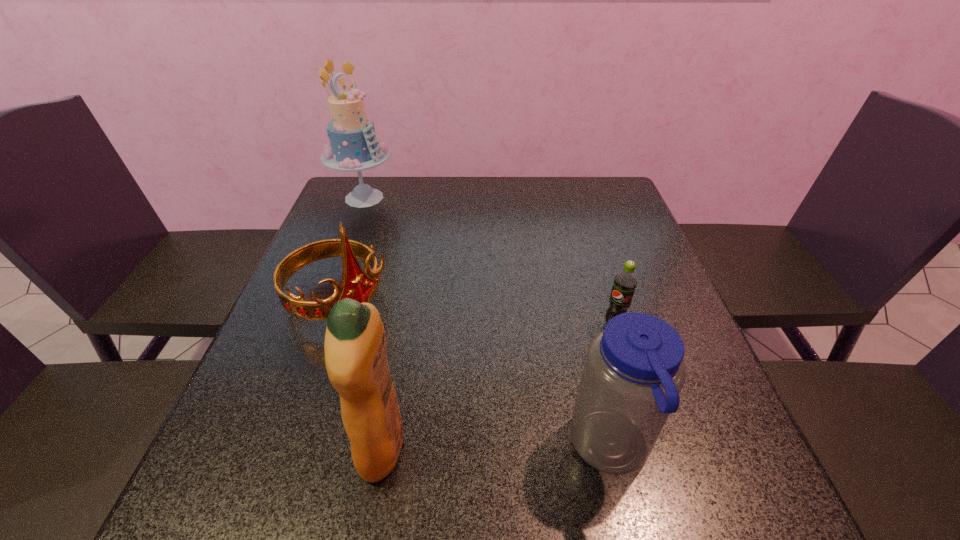
Locate an element on the screen. detergent is located at coordinates (355, 348).

The height and width of the screenshot is (540, 960). Identify the location of the third object from right to left. (355, 348).

I want to click on water bottle, so click(x=634, y=370).

Image resolution: width=960 pixels, height=540 pixels. I want to click on cake, so click(x=353, y=147).

I want to click on the tallest object, so click(353, 147).

Image resolution: width=960 pixels, height=540 pixels. I want to click on the shortest object, so click(625, 282).

Where is `tiara`? tiara is located at coordinates (356, 284).

Image resolution: width=960 pixels, height=540 pixels. Identify the location of vacant space located 0.230m on the label of the detergent. (224, 447).

I want to click on blank space located on the label of the detergent, so click(x=312, y=447).

Where is `free spot located on the label of the detergent`? The width and height of the screenshot is (960, 540). free spot located on the label of the detergent is located at coordinates (224, 447).